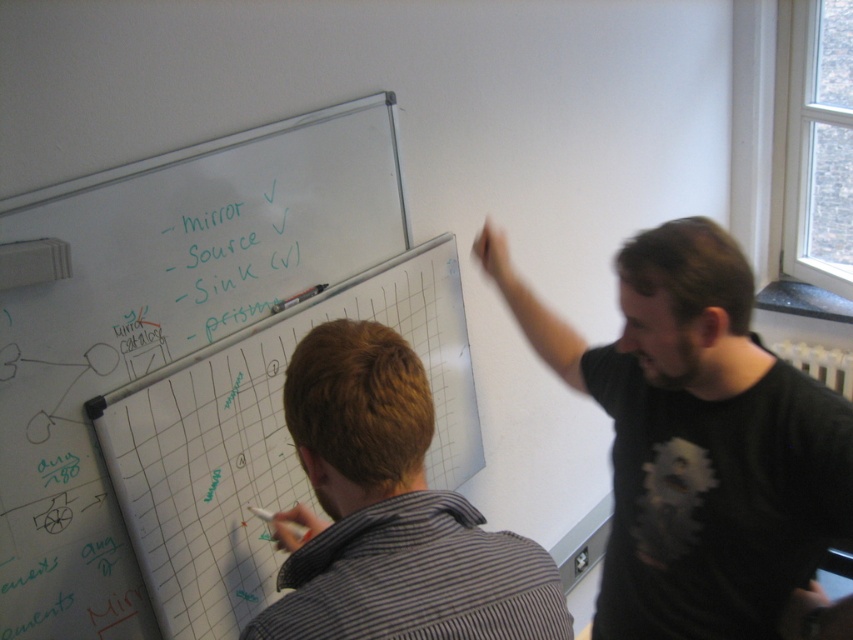
Does point (97, 426) come behind point (515, 568)?

Yes, point (97, 426) is behind point (515, 568).

Which is above, whiteboard at upper left or striped shirt at center?

Positioned higher is striped shirt at center.

Is point (120, 417) closer to camera compared to point (294, 365)?

No, it is behind (294, 365).

The width and height of the screenshot is (853, 640). I want to click on whiteboard at upper left, so click(264, 440).

Is whiteboard at upper left positioned behind green marker text at upper center?

That is False.

Does whiteboard at upper left have a larger size compared to green marker text at upper center?

Yes, whiteboard at upper left is bigger than green marker text at upper center.

The height and width of the screenshot is (640, 853). Describe the element at coordinates (264, 440) in the screenshot. I see `whiteboard at upper left` at that location.

At what (x,y) coordinates should I click in order to perform the action: click on whiteboard at upper left. Please return your answer as a coordinate pair (x, y). The image size is (853, 640). Looking at the image, I should click on (264, 440).

Does whiteboard at upper left have a greater height compared to black matte shirt at upper right?

Indeed, whiteboard at upper left has a greater height compared to black matte shirt at upper right.

Looking at this image, who is more distant from viewer, (216, 520) or (650, 435)?

Point (216, 520)

Is point (463, 413) in front of point (843, 627)?

No, (463, 413) is behind (843, 627).

Where is `whiteboard at upper left`? whiteboard at upper left is located at coordinates (264, 440).